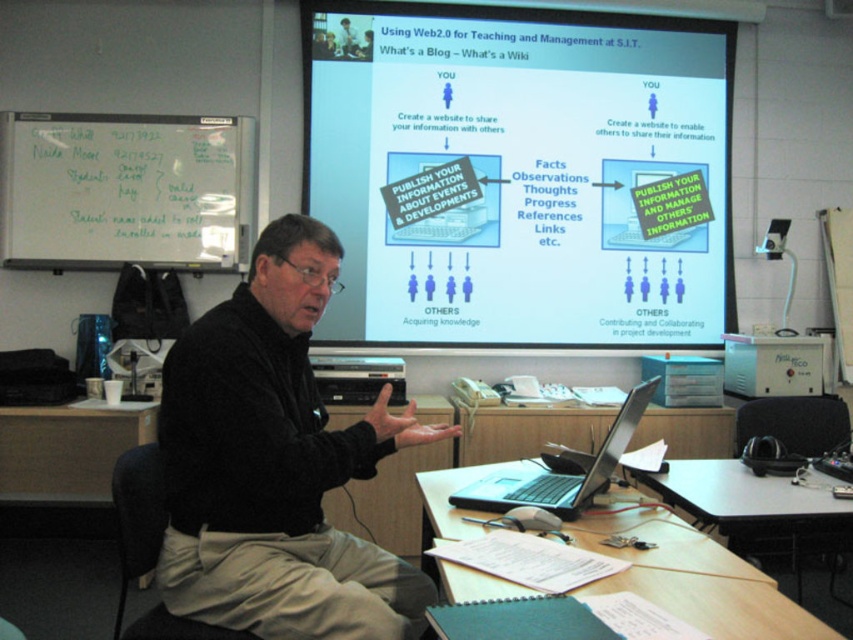
Question: Estimate the real-world distances between objects in this image. Which object is farther from the black sweater at center?

Choices:
 (A) green paper at lower center
 (B) silver/black plastic laptop at lower center
 (C) white matte projection screen at upper center

Answer: (C)

Question: Can you confirm if black sweater at center is positioned above wooden desk at lower left?

Choices:
 (A) no
 (B) yes

Answer: (B)

Question: Can you confirm if green paper at lower center is smaller than silver/black plastic laptop at lower center?

Choices:
 (A) yes
 (B) no

Answer: (B)

Question: Which is nearer to the black sweater at center?

Choices:
 (A) wooden desk at lower left
 (B) silver/black plastic laptop at lower center
 (C) whiteboard at left

Answer: (B)

Question: Which point is closer to the camera taking this photo?

Choices:
 (A) (737, 634)
 (B) (169, 593)

Answer: (A)

Question: Considering the relative positions of white matte projection screen at upper center and wooden desk at lower left in the image provided, where is white matte projection screen at upper center located with respect to wooden desk at lower left?

Choices:
 (A) right
 (B) left

Answer: (A)